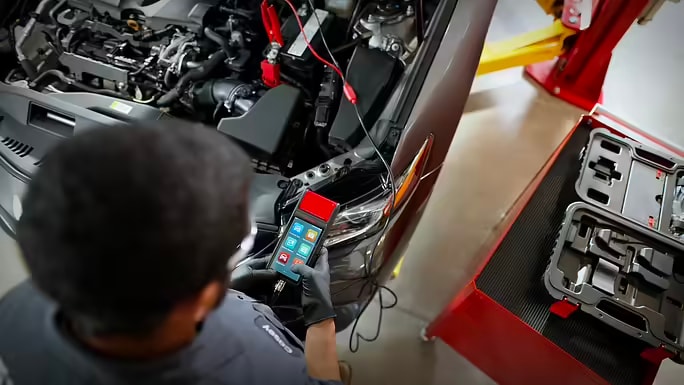
Identify the location of phone. tap(299, 244).